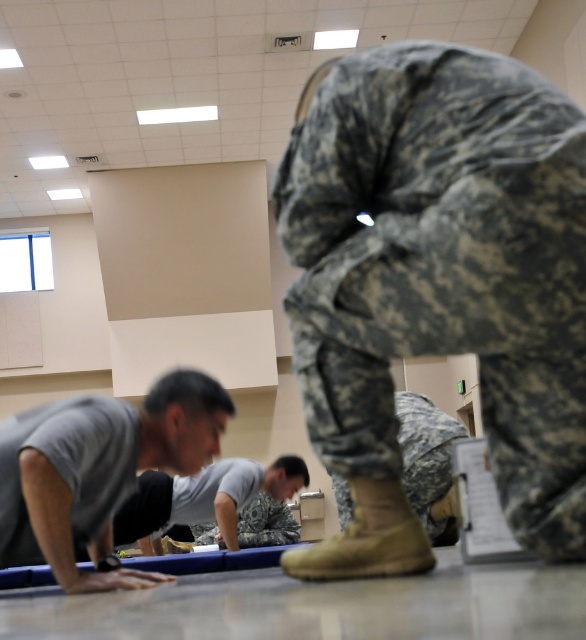
Question: Is gray matte shirt at lower left wider than camouflage fabric pants at center?

Choices:
 (A) no
 (B) yes

Answer: (B)

Question: Which of these objects is positioned closest to the camouflage fabric pants at center?

Choices:
 (A) gray matte t-shirt at lower left
 (B) camouflage fabric uniform at center
 (C) camouflage fabric uniform at upper center

Answer: (A)

Question: Does camouflage fabric pants at center appear under camouflage fabric uniform at center?

Choices:
 (A) yes
 (B) no

Answer: (B)

Question: Which point is closer to the camera taking this photo?

Choices:
 (A) (516, 196)
 (B) (284, 483)
 (C) (454, 497)
 (D) (220, 541)

Answer: (A)

Question: Does gray matte t-shirt at lower left appear under camouflage fabric pants at center?

Choices:
 (A) yes
 (B) no

Answer: (B)

Question: Which point is closer to the camera taking this photo?

Choices:
 (A) (96, 579)
 (B) (264, 545)
 (C) (120, 509)

Answer: (A)